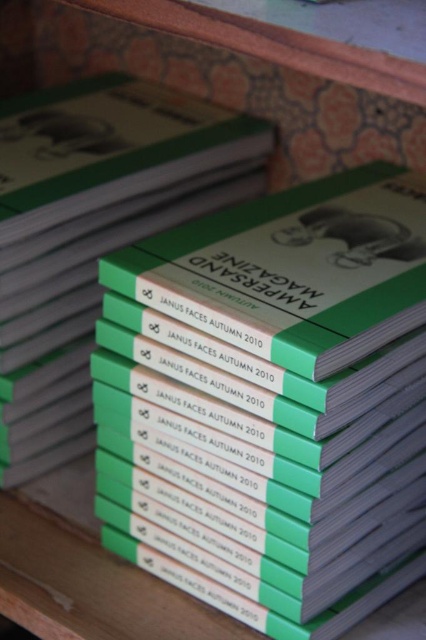
What is located at the coordinates point (94, 234) in the image?

The green matte paper at center is located at point (94, 234).

You are a photographer trying to capture a closeup of the green matte paper at center. If your camera requires the subject to be within 30 inches to focus properly, will you need to adjust your position?

The green matte paper at center and camera are 31.43 inches apart, which is beyond the 30 inches required for proper focus. Therefore, you need to move closer to the green matte paper at center to ensure it is within the 30 inch range.